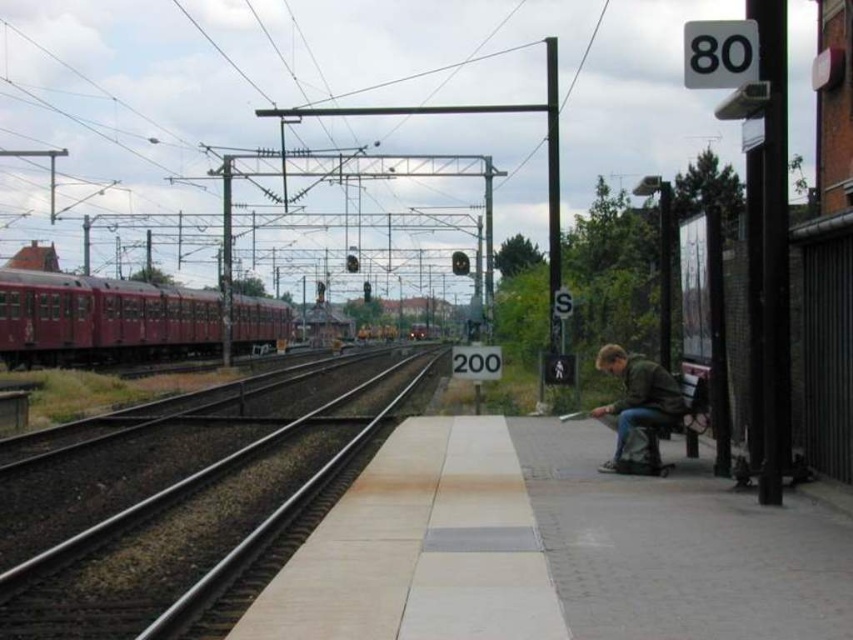
Looking at this image, you are a photographer standing on the platform, and you want to capture both the smooth metal train track at center and the green matte jacket at lower right in a single photo. Which object should you frame first to ensure both are visible in the photo?

The smooth metal train track at center is wider than the green matte jacket at lower right, so you should frame the smooth metal train track at center first to ensure both are visible in the photo.